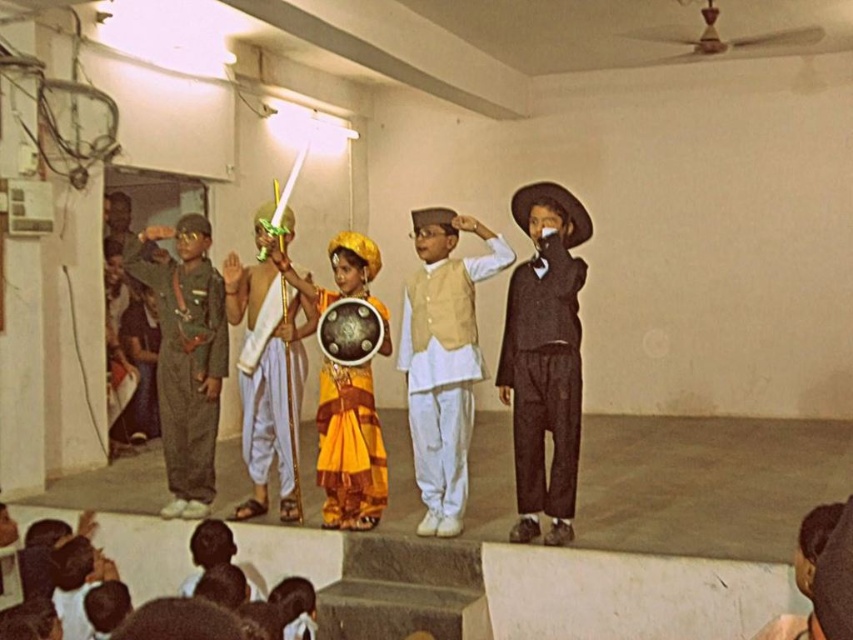
Question: Which is farther from the dark brown woolen suit at right?

Choices:
 (A) green fabric uniform at left
 (B) white cotton kurta at center
 (C) white silk dhoti at center

Answer: (A)

Question: Can you confirm if white cotton kurta at center is positioned below green fabric uniform at left?

Choices:
 (A) no
 (B) yes

Answer: (B)

Question: Does yellow silk sari at center appear under white silk dhoti at center?

Choices:
 (A) no
 (B) yes

Answer: (B)

Question: Estimate the real-world distances between objects in this image. Which object is farther from the yellow silk sari at center?

Choices:
 (A) white silk dhoti at center
 (B) dark brown woolen suit at right
 (C) green fabric uniform at left
 (D) white cotton kurta at center

Answer: (B)

Question: Can you confirm if white cotton kurta at center is positioned below yellow silk sari at center?

Choices:
 (A) no
 (B) yes

Answer: (A)

Question: Among these points, which one is nearest to the camera?

Choices:
 (A) (177, 483)
 (B) (289, 380)
 (C) (566, 460)
 (D) (427, 472)

Answer: (C)